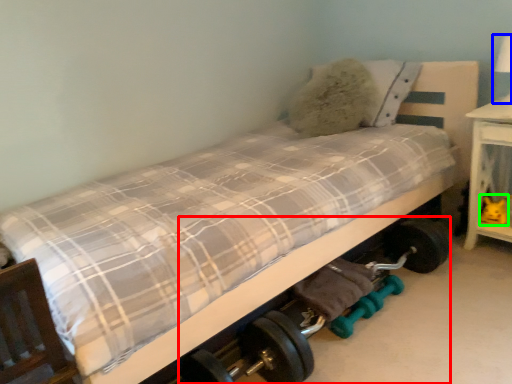
Question: Which object is positioned farthest from baby carriage (highlighted by a red box)? Select from table lamp (highlighted by a blue box) and toy (highlighted by a green box).

Choices:
 (A) table lamp
 (B) toy

Answer: (A)